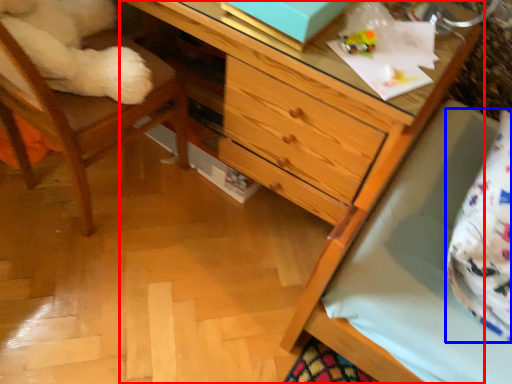
Question: Which object appears closest to the camera in this image, chest of drawers (highlighted by a red box) or pillow (highlighted by a blue box)?

Choices:
 (A) chest of drawers
 (B) pillow

Answer: (B)